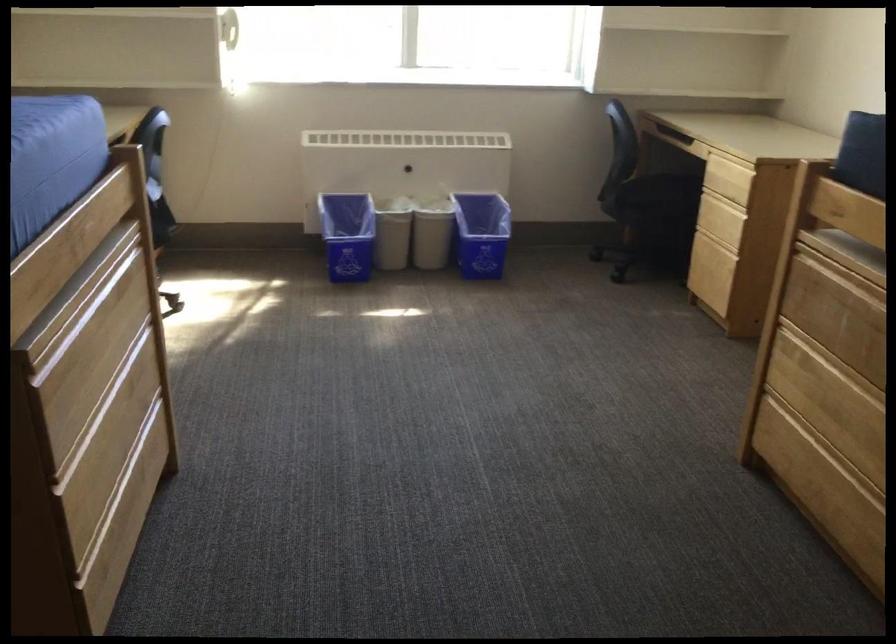
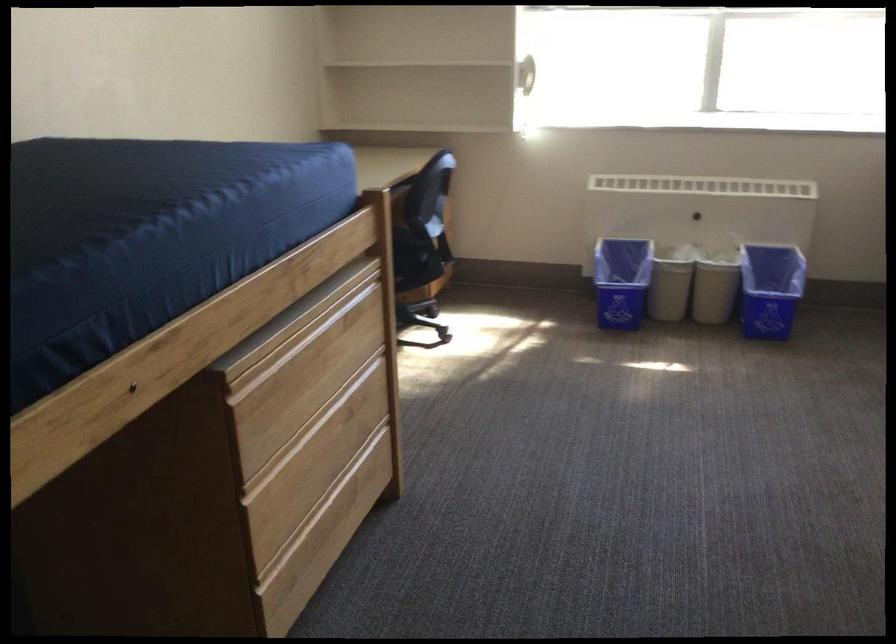
Locate, in the second image, the point that corresponds to (x=433, y=232) in the first image.

(714, 285)